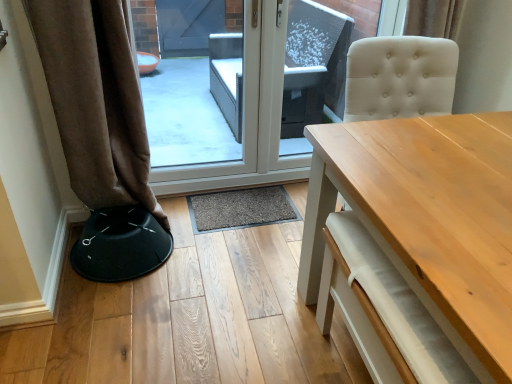
At what (x,y) coordinates should I click in order to perform the action: click on brown fabric curtain at left. Please return your answer as a coordinate pair (x, y). The image size is (512, 384). Looking at the image, I should click on (96, 100).

The height and width of the screenshot is (384, 512). In order to click on black fabric bar stool at lower left in this screenshot , I will do `click(120, 245)`.

Image resolution: width=512 pixels, height=384 pixels. What do you see at coordinates (120, 245) in the screenshot?
I see `black fabric bar stool at lower left` at bounding box center [120, 245].

Measure the distance between point (x=204, y=182) and camera.

They are 8.25 feet apart.

Image resolution: width=512 pixels, height=384 pixels. I want to click on light wood table at center, so click(424, 206).

Is transparent glass door at center inside or outside of beige tufted swivel chair at right?

transparent glass door at center lies outside beige tufted swivel chair at right.

In terms of height, does transparent glass door at center look taller or shorter compared to beige tufted swivel chair at right?

transparent glass door at center is taller than beige tufted swivel chair at right.

Based on the photo, does transparent glass door at center lie behind beige tufted swivel chair at right?

Yes.

Is transparent glass door at center further to the viewer compared to black fabric bar stool at lower left?

That is True.

Is point (383, 30) positioned behind point (111, 219)?

Yes, it is behind point (111, 219).

Is transparent glass door at center taller or shorter than black fabric bar stool at lower left?

In the image, transparent glass door at center appears to be taller than black fabric bar stool at lower left.

Is transparent glass door at center outside of black fabric bar stool at lower left?

That's correct, transparent glass door at center is outside of black fabric bar stool at lower left.

From a real-world perspective, is beige tufted swivel chair at right on top of black fabric bar stool at lower left?

Correct, in the physical world, beige tufted swivel chair at right is higher than black fabric bar stool at lower left.

Is beige tufted swivel chair at right thinner than black fabric bar stool at lower left?

No.

Is beige tufted swivel chair at right in front of or behind black fabric bar stool at lower left in the image?

In the image, beige tufted swivel chair at right appears in front of black fabric bar stool at lower left.

Is light wood table at center aimed at black fabric bar stool at lower left?

No, light wood table at center is not facing towards black fabric bar stool at lower left.

Which object is closer to the camera taking this photo, light wood table at center or black fabric bar stool at lower left?

Positioned in front is light wood table at center.

Which is more to the left, light wood table at center or black fabric bar stool at lower left?

black fabric bar stool at lower left is more to the left.

Looking at this image, is brown fabric curtain at left closer to camera compared to light wood table at center?

No, the depth of brown fabric curtain at left is greater than that of light wood table at center.

Considering the relative sizes of brown fabric curtain at left and light wood table at center in the image provided, is brown fabric curtain at left smaller than light wood table at center?

Indeed, brown fabric curtain at left has a smaller size compared to light wood table at center.

Is brown fabric curtain at left facing towards light wood table at center?

No.

Is brown fabric curtain at left far away from light wood table at center?

A: brown fabric curtain at left is positioned a significant distance from light wood table at center.

Which of these two, light wood table at center or beige tufted swivel chair at right, is wider?

light wood table at center is wider.

Which object is closer to the camera, light wood table at center or beige tufted swivel chair at right?

light wood table at center is closer to the camera.

Is beige tufted swivel chair at right inside light wood table at center?

No, beige tufted swivel chair at right is not a part of light wood table at center.

Is the position of beige tufted swivel chair at right more distant than that of light wood table at center?

Yes, it is behind light wood table at center.

In the scene shown: Considering the relative sizes of beige tufted swivel chair at right and light wood table at center in the image provided, is beige tufted swivel chair at right thinner than light wood table at center?

Yes.

Is beige tufted swivel chair at right with light wood table at center?

No, beige tufted swivel chair at right is not touching light wood table at center.

From the image's perspective, is beige tufted swivel chair at right under light wood table at center?

Incorrect, from the image's perspective, beige tufted swivel chair at right is higher than light wood table at center.

Find the location of a particular element. door below the beige tufted swivel chair at right (from a real-world perspective) is located at coordinates (x=248, y=119).

Where is `door lying on the right of black fabric bar stool at lower left`? This screenshot has width=512, height=384. door lying on the right of black fabric bar stool at lower left is located at coordinates (248, 119).

Which object lies further to the anchor point brown fabric curtain at left, transparent glass door at center or light wood table at center?

light wood table at center lies further to brown fabric curtain at left than the other object.

Consider the image. Looking at the image, which one is located closer to transparent glass door at center, light wood table at center or beige tufted swivel chair at right?

beige tufted swivel chair at right is positioned closer to the anchor transparent glass door at center.

Considering their positions, is beige tufted swivel chair at right positioned further to light wood table at center than transparent glass door at center?

transparent glass door at center is further to light wood table at center.

Looking at the image, which one is located closer to transparent glass door at center, beige tufted swivel chair at right or black fabric bar stool at lower left?

The object closer to transparent glass door at center is black fabric bar stool at lower left.

From the image, which object appears to be nearer to brown fabric curtain at left, black fabric bar stool at lower left or beige tufted swivel chair at right?

Based on the image, black fabric bar stool at lower left appears to be nearer to brown fabric curtain at left.

Based on their spatial positions, is brown fabric curtain at left or black fabric bar stool at lower left further from beige tufted swivel chair at right?

Based on the image, black fabric bar stool at lower left appears to be further to beige tufted swivel chair at right.

Looking at this image, based on their spatial positions, is light wood table at center or brown fabric curtain at left further from transparent glass door at center?

Based on the image, light wood table at center appears to be further to transparent glass door at center.

Based on their spatial positions, is brown fabric curtain at left or beige tufted swivel chair at right further from light wood table at center?

brown fabric curtain at left.

Locate an element on the screen. Image resolution: width=512 pixels, height=384 pixels. bar stool between light wood table at center and transparent glass door at center along the z-axis is located at coordinates (120, 245).

The width and height of the screenshot is (512, 384). I want to click on swivel chair between light wood table at center and transparent glass door at center along the z-axis, so click(400, 77).

This screenshot has width=512, height=384. I want to click on door between brown fabric curtain at left and light wood table at center from left to right, so click(248, 119).

I want to click on door located between brown fabric curtain at left and beige tufted swivel chair at right in the left-right direction, so pyautogui.click(x=248, y=119).